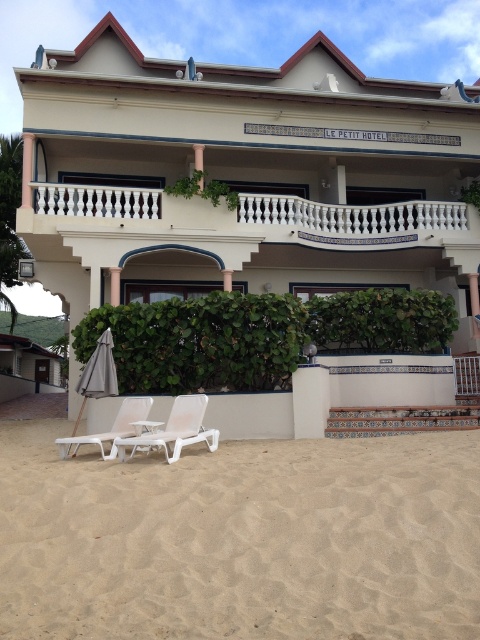
You are standing at the entrance of Le Petit Hotel and want to reach the sea. According to the image, where should you head towards to find the beige sandy beach at lower center?

The beige sandy beach at lower center is located at point (240, 540), so you should head towards that coordinate to reach the sea.

You are standing at the entrance of Le Petit Hotel and want to walk towards the two points marked on the beach. Which point, point (145, 448) or point (91, 356), is closer to you?

Point (145, 448) is closer to the viewer than point (91, 356).